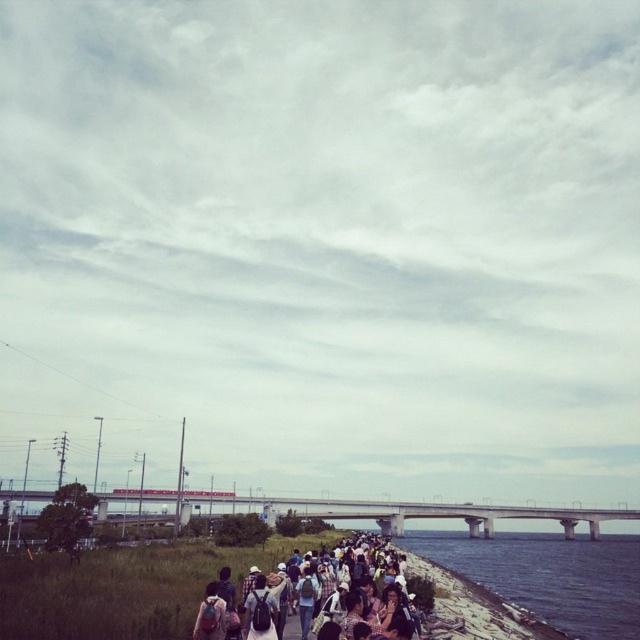
Which is in front, point (468, 548) or point (472, 529)?

Point (468, 548)

Does point (620, 536) come closer to viewer compared to point (102, 515)?

No, (620, 536) is behind (102, 515).

The height and width of the screenshot is (640, 640). I want to click on clear water at lower right, so click(x=548, y=576).

Which is behind, point (630, 602) or point (262, 634)?

The point (630, 602) is behind.

What do you see at coordinates (548, 576) in the screenshot? I see `clear water at lower right` at bounding box center [548, 576].

Locate an element on the screen. The height and width of the screenshot is (640, 640). clear water at lower right is located at coordinates (548, 576).

In the scene shown: Between matte black backpack at center and concrete bridge at center, which one appears on the left side from the viewer's perspective?

Positioned to the left is matte black backpack at center.

From the picture: Which of these two, matte black backpack at center or concrete bridge at center, stands shorter?

matte black backpack at center is shorter.

Identify the location of matte black backpack at center. (310, 598).